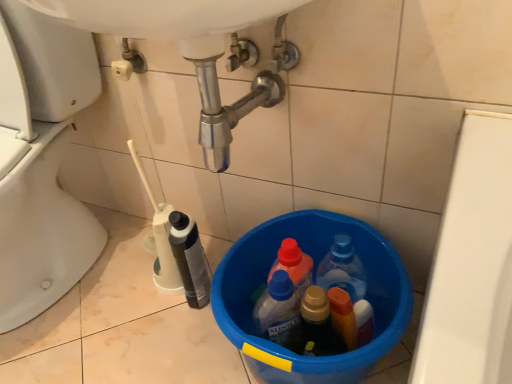
Question: Is the depth of white glossy toilet at lower left greater than that of blue plastic bucket at lower center?

Choices:
 (A) no
 (B) yes

Answer: (A)

Question: Can you confirm if white glossy toilet at lower left is wider than blue plastic bucket at lower center?

Choices:
 (A) no
 (B) yes

Answer: (B)

Question: Is blue plastic bucket at lower center inside white glossy toilet at lower left?

Choices:
 (A) no
 (B) yes

Answer: (A)

Question: Can you confirm if white glossy toilet at lower left is smaller than blue plastic bucket at lower center?

Choices:
 (A) yes
 (B) no

Answer: (B)

Question: Can you confirm if white glossy toilet at lower left is thinner than blue plastic bucket at lower center?

Choices:
 (A) no
 (B) yes

Answer: (A)

Question: From a real-world perspective, relative to white plastic bottle at lower left, is blue plastic bucket at lower center vertically above or below?

Choices:
 (A) above
 (B) below

Answer: (B)

Question: Relative to white plastic bottle at lower left, is blue plastic bucket at lower center in front or behind?

Choices:
 (A) behind
 (B) front

Answer: (B)

Question: Which is correct: blue plastic bucket at lower center is inside white plastic bottle at lower left, or outside of it?

Choices:
 (A) inside
 (B) outside

Answer: (B)

Question: Is blue plastic bucket at lower center bigger or smaller than white plastic bottle at lower left?

Choices:
 (A) small
 (B) big

Answer: (B)

Question: Is blue plastic bucket at lower center to the left or to the right of white glossy toilet at lower left in the image?

Choices:
 (A) left
 (B) right

Answer: (B)

Question: In the image, is blue plastic bucket at lower center positioned in front of or behind white glossy toilet at lower left?

Choices:
 (A) behind
 (B) front

Answer: (A)

Question: Considering the positions of blue plastic bucket at lower center and white glossy toilet at lower left in the image, is blue plastic bucket at lower center taller or shorter than white glossy toilet at lower left?

Choices:
 (A) tall
 (B) short

Answer: (B)

Question: Would you say blue plastic bucket at lower center is inside or outside white glossy toilet at lower left?

Choices:
 (A) inside
 (B) outside

Answer: (B)

Question: From a real-world perspective, is white plastic bottle at lower left above or below white glossy toilet at lower left?

Choices:
 (A) above
 (B) below

Answer: (B)

Question: Is point (203, 281) positioned closer to the camera than point (15, 311)?

Choices:
 (A) farther
 (B) closer

Answer: (B)